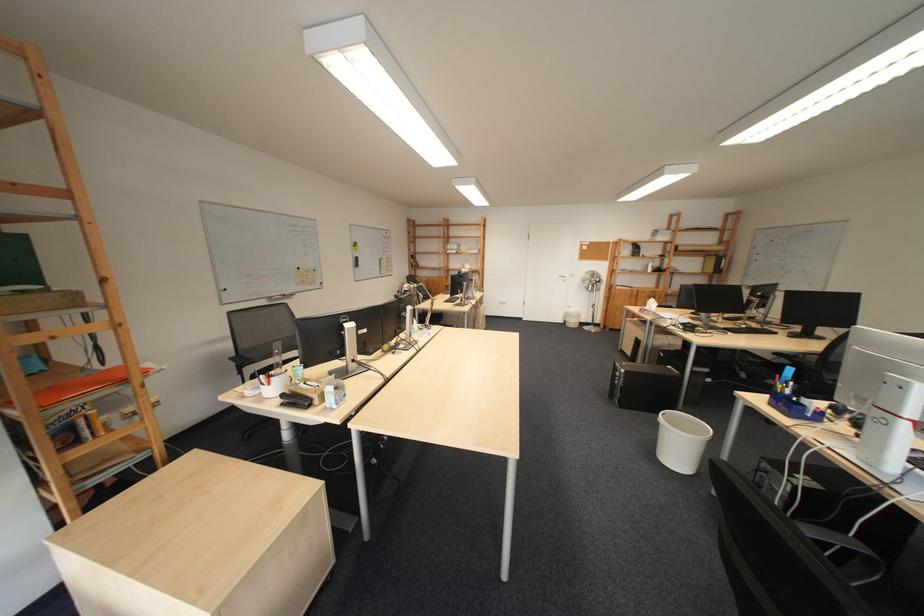
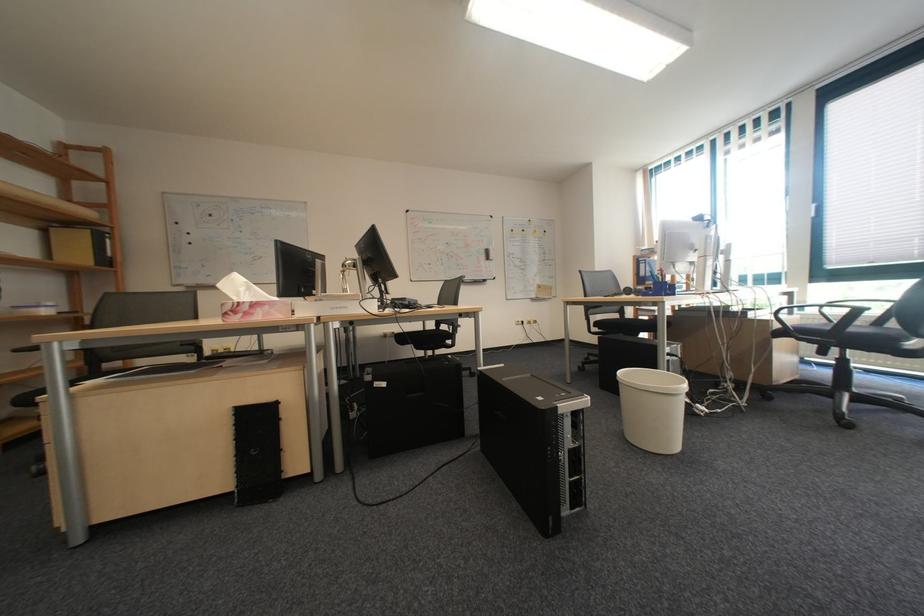
Where in the second image is the point corresponding to point 728,257 from the first image?

(103, 232)